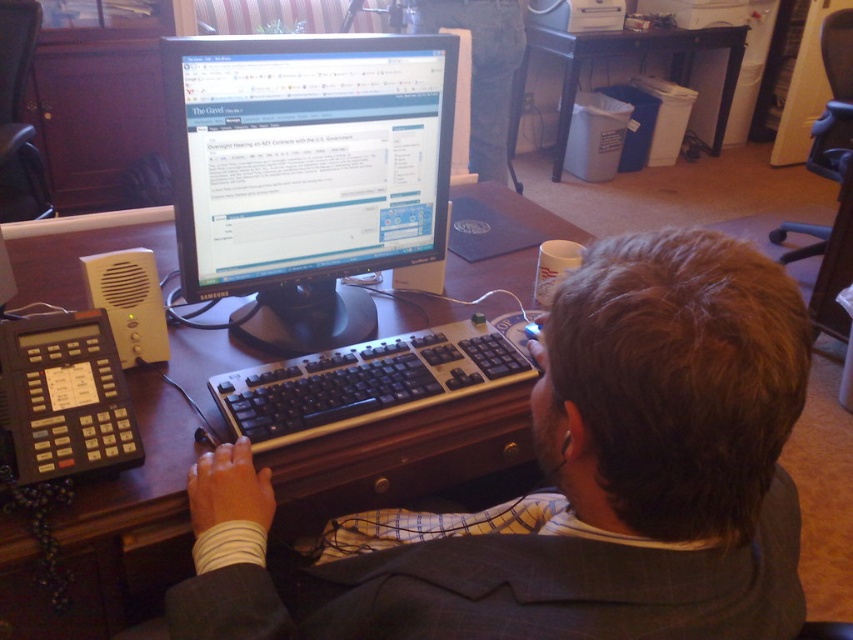
Is wooden at center wider than black plastic keyboard at center?

Correct, the width of wooden at center exceeds that of black plastic keyboard at center.

Between wooden at center and black plastic keyboard at center, which one has more height?

With more height is wooden at center.

Between point (386, 324) and point (323, 426), which one is positioned in front?

Point (323, 426) is in front.

Where is `wooden at center`? This screenshot has width=853, height=640. wooden at center is located at coordinates (111, 532).

Is point (380, 156) farther from camera compared to point (485, 380)?

Yes.

Is black glossy monitor at center in front of black plastic keyboard at center?

Yes, it is.

Describe the element at coordinates (306, 172) in the screenshot. The image size is (853, 640). I see `black glossy monitor at center` at that location.

Locate an element on the screen. The width and height of the screenshot is (853, 640). black glossy monitor at center is located at coordinates pyautogui.click(x=306, y=172).

Can you confirm if wooden at center is bigger than white plastic trash can at lower right?

No.

Who is positioned more to the left, wooden at center or white plastic trash can at lower right?

wooden at center

Identify the location of wooden at center. (111, 532).

I want to click on wooden at center, so click(111, 532).